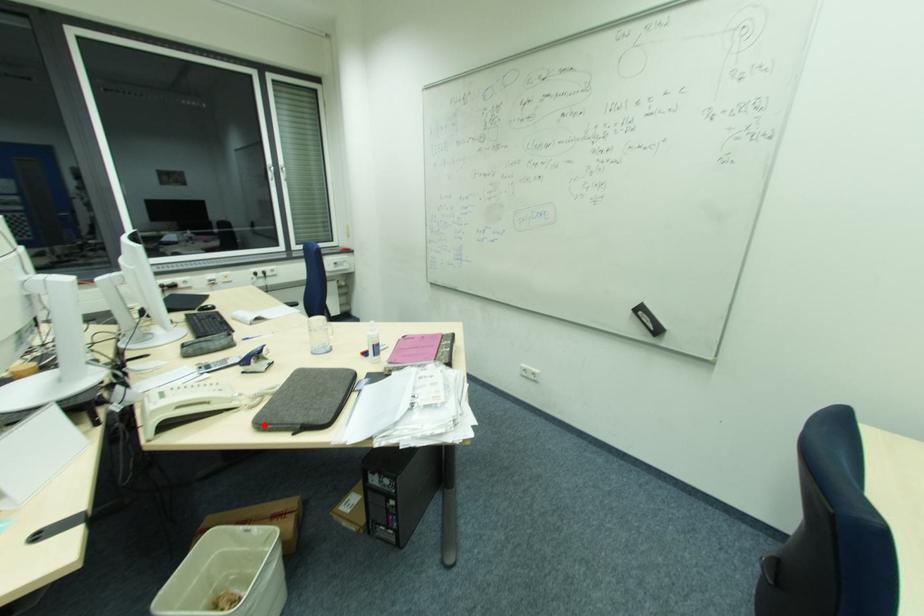
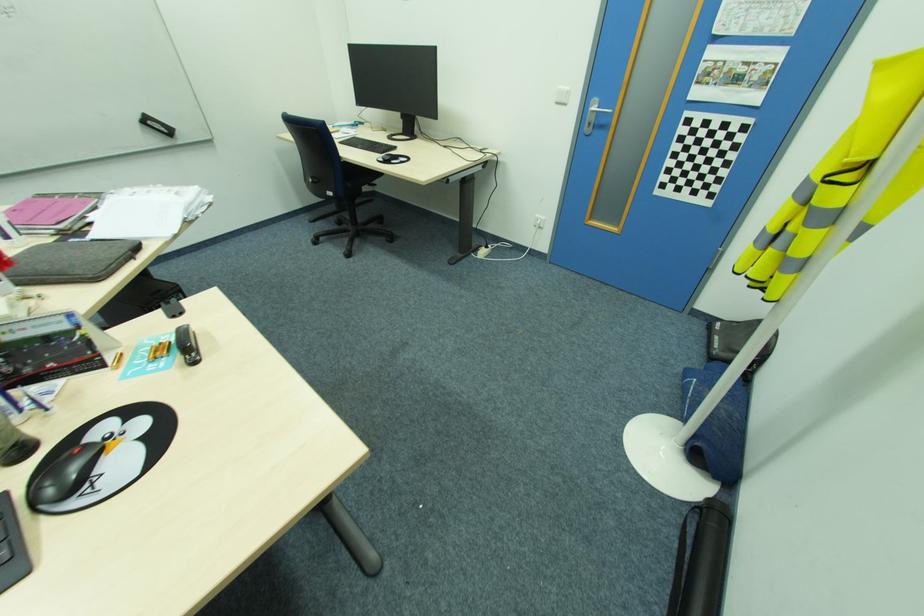
In the second image, find the point that corresponds to the highlighted location in the first image.

(99, 278)